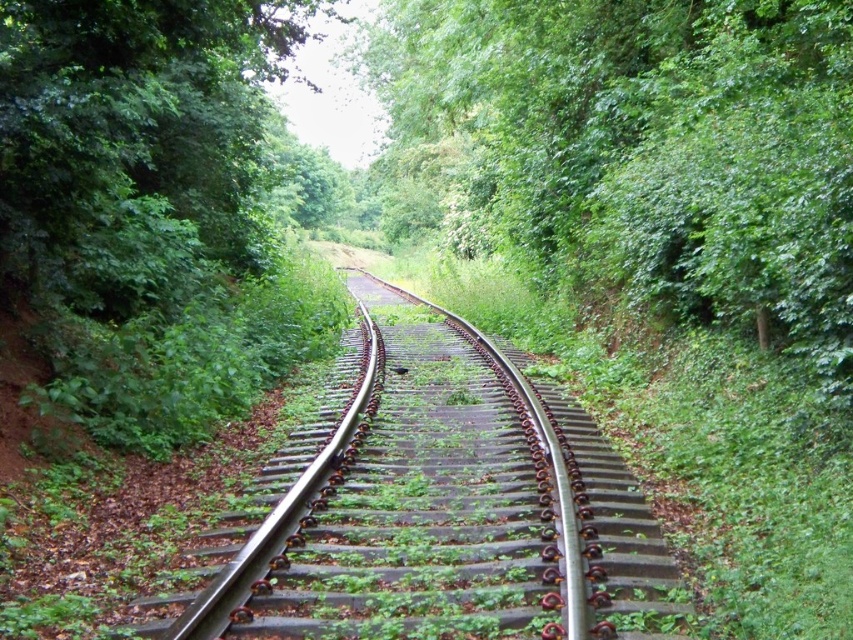
You are standing at the point labeled as point [641,150] in the image. Based on the scene description, what would you most likely see around you?

You would most likely see the green leafy tree at center around you since the point [641,150] is on it.